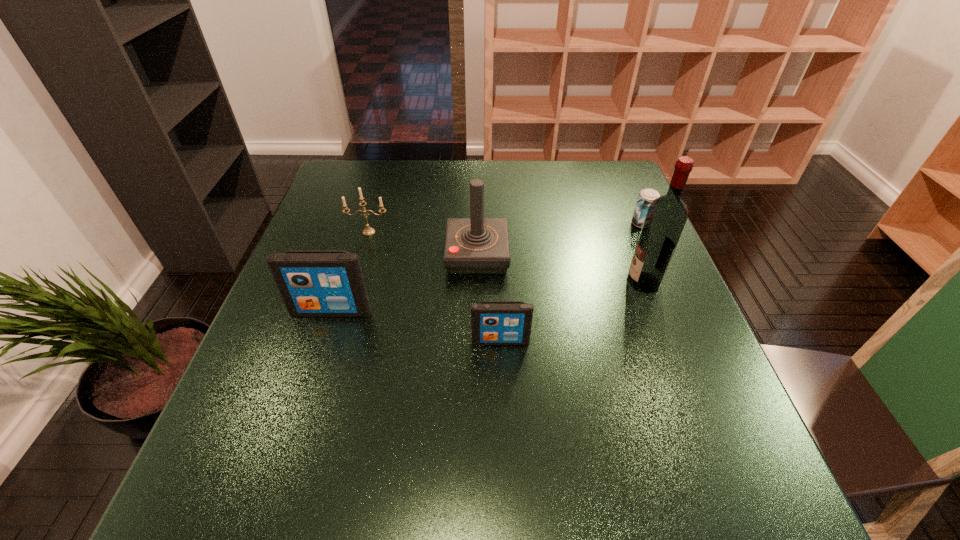
The height and width of the screenshot is (540, 960). In the image, there is a desktop. In order to click on vacant space at the far edge in this screenshot , I will do `click(549, 191)`.

Locate an element on the screen. This screenshot has height=540, width=960. free region at the left edge is located at coordinates (325, 243).

Where is `vacant space at the right edge of the desktop`? vacant space at the right edge of the desktop is located at coordinates (668, 289).

I want to click on vacant area at the far left corner of the desktop, so click(x=344, y=191).

Locate an element on the screen. vacant area that lies between the shorter iPod and the alcohol is located at coordinates (572, 312).

I want to click on vacant area that lies between the nearer iPod and the joystick, so click(489, 298).

Locate an element on the screen. The width and height of the screenshot is (960, 540). vacant area that lies between the alcohol and the nearest object is located at coordinates (572, 312).

Find the location of a particular element. free space that is in between the tallest object and the fifth farthest object is located at coordinates (488, 296).

Where is `vacant area between the farther iPod and the shorter iPod`? The width and height of the screenshot is (960, 540). vacant area between the farther iPod and the shorter iPod is located at coordinates (416, 326).

This screenshot has height=540, width=960. I want to click on free space between the second tallest object and the alcohol, so click(x=561, y=268).